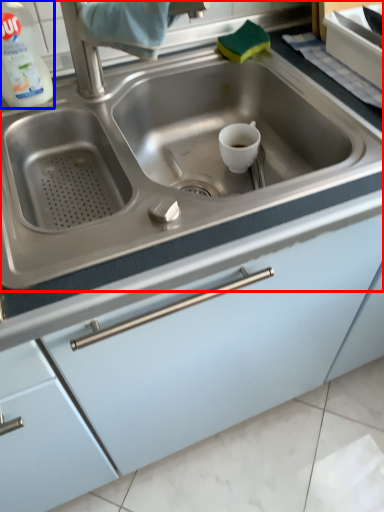
Question: Which object is closer to the camera taking this photo, sink (highlighted by a red box) or cleaning product (highlighted by a blue box)?

Choices:
 (A) sink
 (B) cleaning product

Answer: (A)